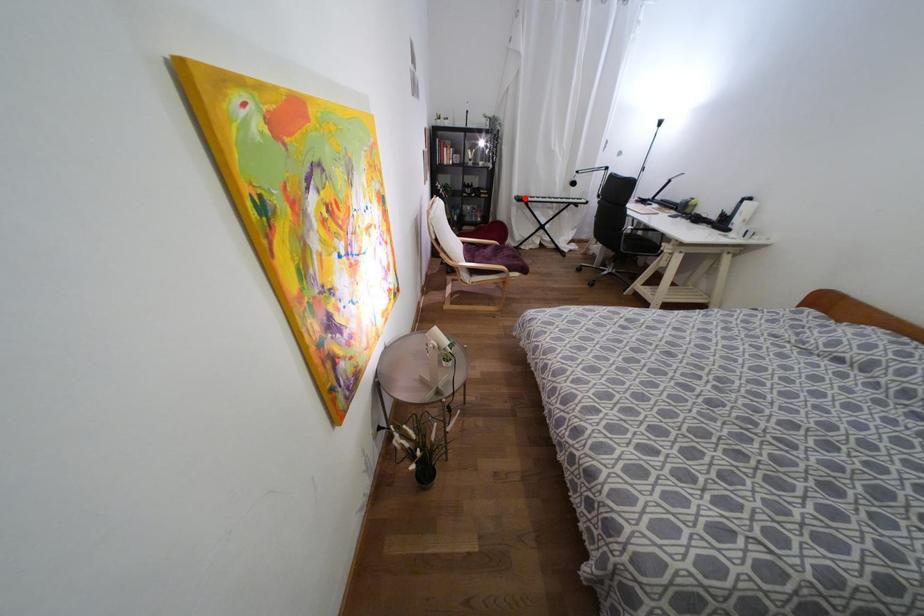
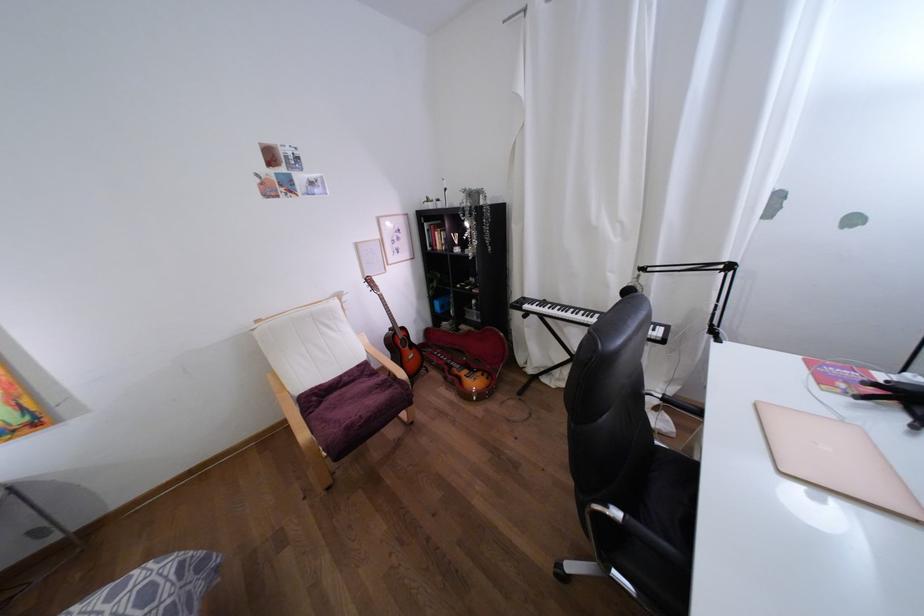
Question: I am providing you with two images of the same scene from different viewpoints. In image1, a red point is highlighted. Considering the same 3D point in image2, which of the following is correct?

Choices:
 (A) It is closer
 (B) It is farther

Answer: (B)